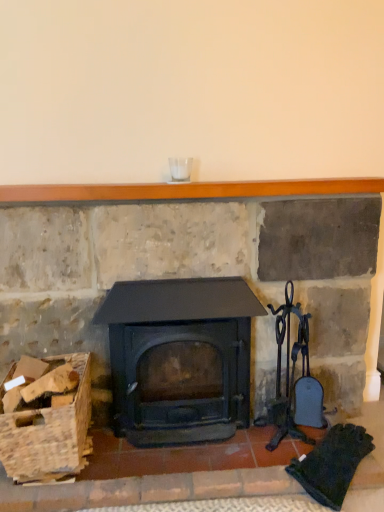
At what (x,y) coordinates should I click in order to perform the action: click on wooden crate at lower left. Please return your answer as a coordinate pair (x, y). Looking at the image, I should click on (48, 430).

Where is `balustrade that is on the right side of matte black wood burning stove at center`? balustrade that is on the right side of matte black wood burning stove at center is located at coordinates [x=188, y=190].

Looking at this image, does wooden mantlepiece at upper center have a smaller size compared to matte black wood burning stove at center?

Yes, wooden mantlepiece at upper center is smaller than matte black wood burning stove at center.

Is wooden mantlepiece at upper center oriented towards matte black wood burning stove at center?

No, wooden mantlepiece at upper center does not turn towards matte black wood burning stove at center.

Is matte black wood burning stove at center far away from wooden mantlepiece at upper center?

matte black wood burning stove at center is actually quite close to wooden mantlepiece at upper center.

Is matte black wood burning stove at center turned away from wooden mantlepiece at upper center?

No, matte black wood burning stove at center's orientation is not away from wooden mantlepiece at upper center.

From a real-world perspective, which object rests below the other?

matte black wood burning stove at center is physically lower.

Looking at this image, does matte black wood burning stove at center lie behind wooden mantlepiece at upper center?

That is False.

From the image's perspective, between wooden crate at lower left and wooden mantlepiece at upper center, who is located below?

From the image's view, wooden crate at lower left is below.

Does point (5, 438) come closer to viewer compared to point (179, 192)?

Yes, it is.

Is wooden mantlepiece at upper center surrounded by wooden crate at lower left?

No, wooden mantlepiece at upper center is not surrounded by wooden crate at lower left.

Does point (113, 397) come farther from viewer compared to point (55, 455)?

Yes, point (113, 397) is behind point (55, 455).

From the image's perspective, which is below, matte black wood burning stove at center or wooden crate at lower left?

From the image's view, wooden crate at lower left is below.

From a real-world perspective, who is located lower, matte black wood burning stove at center or wooden crate at lower left?

wooden crate at lower left, from a real-world perspective.

Consider the image. Considering the relative sizes of matte black wood burning stove at center and wooden crate at lower left in the image provided, is matte black wood burning stove at center shorter than wooden crate at lower left?

No, matte black wood burning stove at center is not shorter than wooden crate at lower left.

Does point (227, 183) come farther from viewer compared to point (5, 450)?

Yes.

Is wooden mantlepiece at upper center inside or outside of wooden crate at lower left?

wooden mantlepiece at upper center is located beyond the bounds of wooden crate at lower left.

Is wooden mantlepiece at upper center in front of wooden crate at lower left?

No, the depth of wooden mantlepiece at upper center is greater than that of wooden crate at lower left.

Is wooden crate at lower left positioned with its back to matte black wood burning stove at center?

No.

Considering the relative sizes of wooden crate at lower left and matte black wood burning stove at center in the image provided, is wooden crate at lower left wider than matte black wood burning stove at center?

Yes.

Considering the sizes of wooden crate at lower left and matte black wood burning stove at center in the image, is wooden crate at lower left bigger or smaller than matte black wood burning stove at center?

wooden crate at lower left is smaller than matte black wood burning stove at center.

This screenshot has width=384, height=512. Find the location of `balustrade located above the matte black wood burning stove at center (from a real-world perspective)`. balustrade located above the matte black wood burning stove at center (from a real-world perspective) is located at coordinates coord(188,190).

I want to click on wood burning stove that is under the wooden mantlepiece at upper center (from a real-world perspective), so click(x=179, y=358).

When comparing their distances from wooden crate at lower left, does matte black wood burning stove at center or wooden mantlepiece at upper center seem closer?

matte black wood burning stove at center.

Which object lies further to the anchor point matte black wood burning stove at center, wooden crate at lower left or wooden mantlepiece at upper center?

Based on the image, wooden mantlepiece at upper center appears to be further to matte black wood burning stove at center.

Estimate the real-world distances between objects in this image. Which object is closer to wooden mantlepiece at upper center, matte black wood burning stove at center or wooden crate at lower left?

matte black wood burning stove at center lies closer to wooden mantlepiece at upper center than the other object.

Looking at the image, which one is located further to matte black wood burning stove at center, wooden mantlepiece at upper center or wooden crate at lower left?

wooden mantlepiece at upper center is positioned further to the anchor matte black wood burning stove at center.

When comparing their distances from wooden mantlepiece at upper center, does wooden crate at lower left or matte black wood burning stove at center seem further?

Among the two, wooden crate at lower left is located further to wooden mantlepiece at upper center.

When comparing their distances from wooden crate at lower left, does wooden mantlepiece at upper center or matte black wood burning stove at center seem closer?

matte black wood burning stove at center lies closer to wooden crate at lower left than the other object.

You are a GUI agent. You are given a task and a screenshot of the screen. Output one action in this format:
    pyautogui.click(x=<x>, y=<y>)
    Task: Click on the wood burning stove between wooden mantlepiece at upper center and wooden crate at lower left in the up-down direction
    
    Given the screenshot: What is the action you would take?
    pyautogui.click(x=179, y=358)